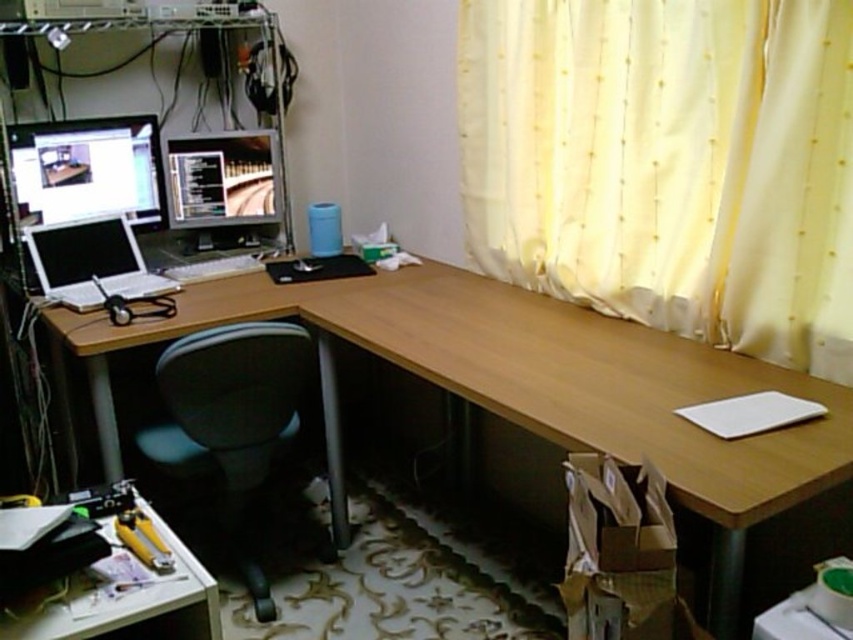
You are standing in front of the workspace setup and want to reach the point marked at coordinates (227, 204). Considering your height is 1.7 meters, can you safely step onto the desk to reach it without knocking over the blue cylindrical container near the center?

The point at coordinates (227, 204) is 2.90 meters away from the viewer. Since the desk is part of the workspace setup and the blue cylindrical container is near the center, stepping onto the desk might risk knocking over the container. However, the distance from the viewer to the point is 2.90 meters, which may require careful movement to avoid contact with nearby objects.

You are organizing your desk and need to place a new item between the matte black monitor at left and the yellow plastic tool at lower left. Based on their positions, where should you place the item?

Since the matte black monitor at left is above the yellow plastic tool at lower left, you should place the new item in between them along the vertical axis, positioning it below the monitor and above the tool to maintain spatial order.

You are moving a new lamp into this workspace and need to place it on the desk. Considering the black fabric swivel chair at lower left and the matte black monitor at left, which object should you avoid placing the lamp near to ensure there is enough space?

You should avoid placing the lamp near the black fabric swivel chair at lower left because it is larger in size than the matte black monitor at left, leaving less space around it.